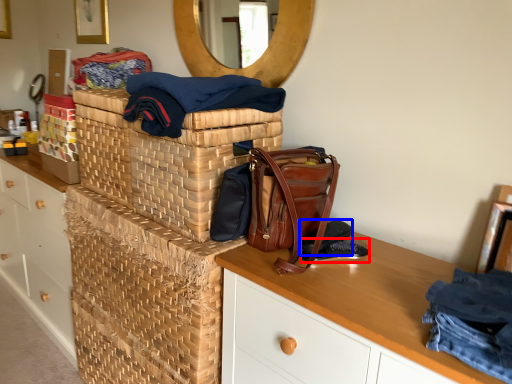
Question: Among these objects, which one is farthest to the camera, shoe (highlighted by a red box) or shoe (highlighted by a blue box)?

Choices:
 (A) shoe
 (B) shoe

Answer: (A)